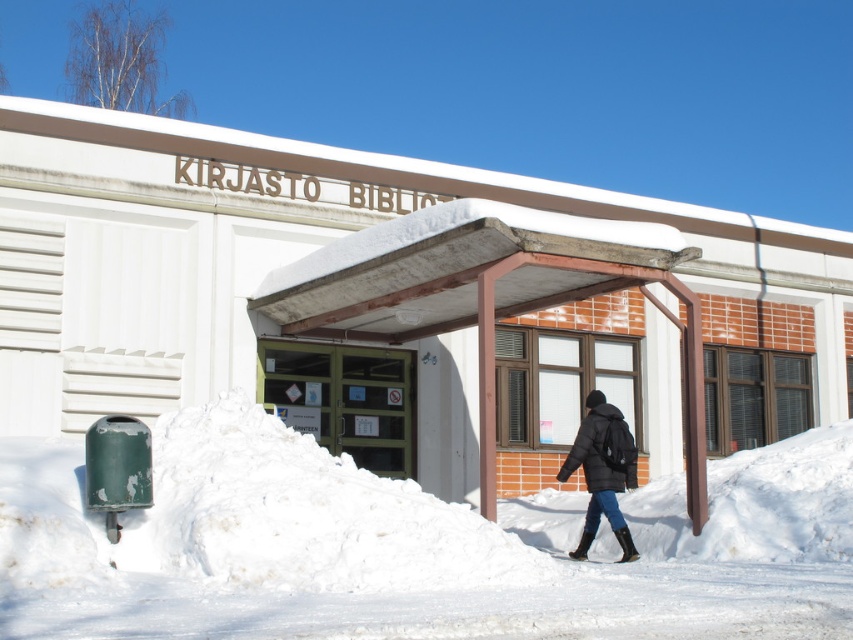
Is white fluffy snow at lower center closer to the viewer compared to wooden awning at center?

Yes, white fluffy snow at lower center is closer to the viewer.

Locate an element on the screen. This screenshot has height=640, width=853. white fluffy snow at lower center is located at coordinates 412,547.

Is point (827, 428) closer to viewer compared to point (577, 237)?

That is False.

Locate an element on the screen. white fluffy snow at lower center is located at coordinates (412, 547).

At what (x,y) coordinates should I click in order to perform the action: click on white fluffy snow at lower center. Please return your answer as a coordinate pair (x, y). Looking at the image, I should click on (412, 547).

Can you confirm if white fluffy snow at lower center is positioned above black puffy coat at center?

Incorrect, white fluffy snow at lower center is not positioned above black puffy coat at center.

Is point (125, 564) positioned behind point (595, 404)?

No, it is in front of (595, 404).

Locate an element on the screen. white fluffy snow at lower center is located at coordinates (412, 547).

Is wooden awning at center above black puffy coat at center?

Correct, wooden awning at center is located above black puffy coat at center.

Is point (508, 285) positioned before point (569, 451)?

No.

Image resolution: width=853 pixels, height=640 pixels. Describe the element at coordinates (488, 294) in the screenshot. I see `wooden awning at center` at that location.

Where is `wooden awning at center`? The width and height of the screenshot is (853, 640). wooden awning at center is located at coordinates (488, 294).